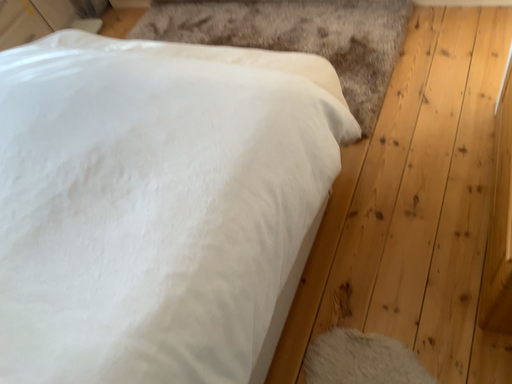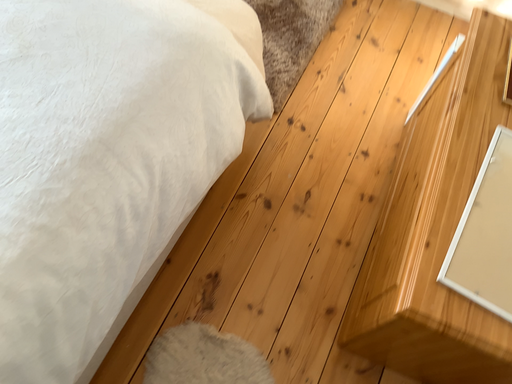
Question: How did the camera likely rotate when shooting the video?

Choices:
 (A) rotated right
 (B) rotated left

Answer: (A)